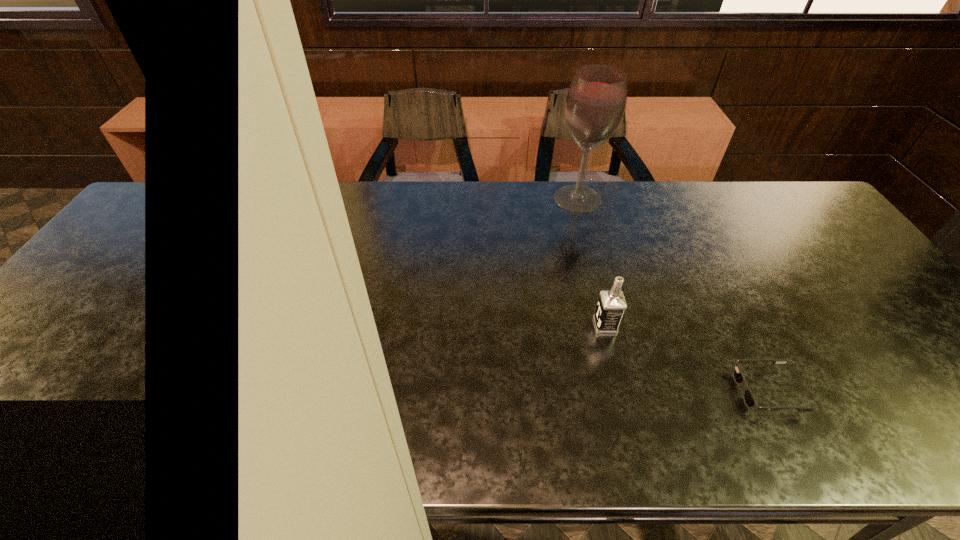
Where is `vacant space located 0.380m on the temples of the rightmost object`? The width and height of the screenshot is (960, 540). vacant space located 0.380m on the temples of the rightmost object is located at coordinates (565, 391).

At what (x,y) coordinates should I click in order to perform the action: click on free point located on the temples of the rightmost object. Please return your answer as a coordinate pair (x, y). The width and height of the screenshot is (960, 540). Looking at the image, I should click on (637, 391).

Where is `free location located on the temples of the rightmost object`? free location located on the temples of the rightmost object is located at coordinates (665, 391).

The height and width of the screenshot is (540, 960). I want to click on object at the far edge, so click(596, 100).

Where is `object at the near edge`? This screenshot has height=540, width=960. object at the near edge is located at coordinates (738, 376).

Locate an element on the screen. vacant region at the far edge of the desktop is located at coordinates (288, 182).

Where is `free location at the near edge of the desktop`? The image size is (960, 540). free location at the near edge of the desktop is located at coordinates (766, 429).

The image size is (960, 540). Identify the location of vacant space at the left edge of the desktop. [164, 228].

I want to click on free region at the right edge, so click(862, 285).

Image resolution: width=960 pixels, height=540 pixels. In the image, there is a desktop. Identify the location of vacant space at the far left corner. (172, 209).